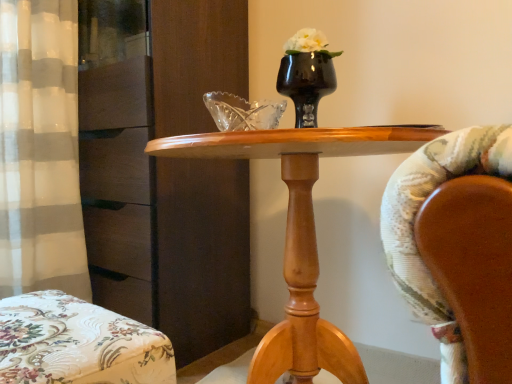
Question: Considering the relative sizes of wooden table at center and floral fabric ottoman at lower left in the image provided, is wooden table at center taller than floral fabric ottoman at lower left?

Choices:
 (A) yes
 (B) no

Answer: (A)

Question: Is wooden table at center looking in the opposite direction of floral fabric ottoman at lower left?

Choices:
 (A) yes
 (B) no

Answer: (B)

Question: Can we say wooden table at center lies outside floral fabric ottoman at lower left?

Choices:
 (A) no
 (B) yes

Answer: (B)

Question: Would you say wooden table at center is a long distance from floral fabric ottoman at lower left?

Choices:
 (A) yes
 (B) no

Answer: (B)

Question: Could you tell me if wooden table at center is turned towards floral fabric ottoman at lower left?

Choices:
 (A) no
 (B) yes

Answer: (B)

Question: Choose the correct answer: Is black glossy vase at center inside wooden table at center or outside it?

Choices:
 (A) outside
 (B) inside

Answer: (A)

Question: Based on their positions, is black glossy vase at center located to the left or right of wooden table at center?

Choices:
 (A) left
 (B) right

Answer: (B)

Question: From the image's perspective, relative to wooden table at center, is black glossy vase at center above or below?

Choices:
 (A) below
 (B) above

Answer: (B)

Question: From a real-world perspective, is black glossy vase at center physically located above or below wooden table at center?

Choices:
 (A) above
 (B) below

Answer: (A)

Question: Based on their sizes in the image, would you say black glossy vase at center is bigger or smaller than floral fabric ottoman at lower left?

Choices:
 (A) big
 (B) small

Answer: (B)

Question: From the image's perspective, is black glossy vase at center located above or below floral fabric ottoman at lower left?

Choices:
 (A) above
 (B) below

Answer: (A)

Question: From a real-world perspective, is black glossy vase at center positioned above or below floral fabric ottoman at lower left?

Choices:
 (A) below
 (B) above

Answer: (B)

Question: Based on their positions, is black glossy vase at center located to the left or right of floral fabric ottoman at lower left?

Choices:
 (A) left
 (B) right

Answer: (B)

Question: Is black glossy vase at center taller or shorter than matte brown dresser at left?

Choices:
 (A) short
 (B) tall

Answer: (A)

Question: Looking at their shapes, would you say black glossy vase at center is wider or thinner than matte brown dresser at left?

Choices:
 (A) thin
 (B) wide

Answer: (A)